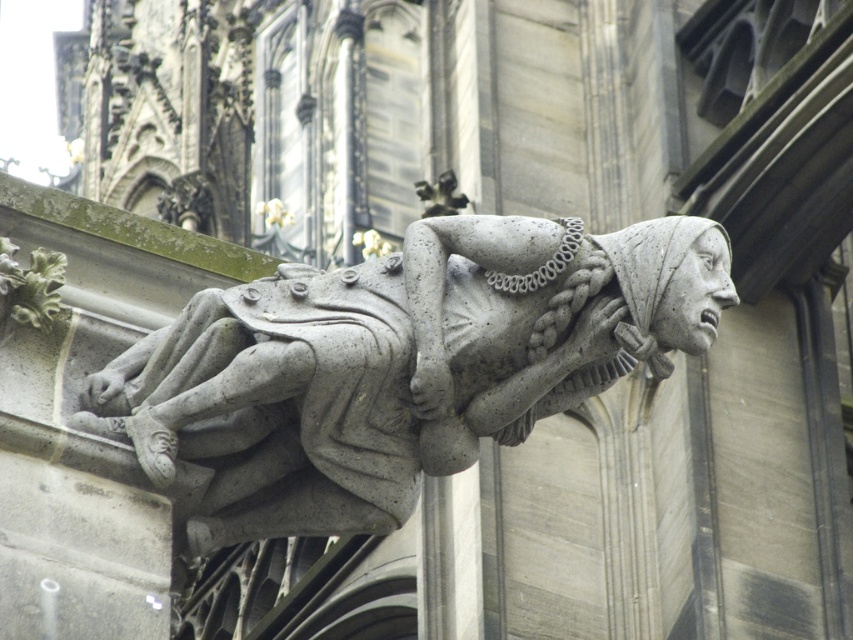
Question: Is gray stone head at center further to camera compared to gray stone gargoyle at upper center?

Choices:
 (A) yes
 (B) no

Answer: (B)

Question: Is gray stone gargoyle at center positioned behind gray stone head at center?

Choices:
 (A) yes
 (B) no

Answer: (A)

Question: Among these objects, which one is farthest from the camera?

Choices:
 (A) gray stone head at center
 (B) gray stone gargoyle at center
 (C) gray stone gargoyle at upper center

Answer: (C)

Question: Which object appears farthest from the camera in this image?

Choices:
 (A) gray stone gargoyle at center
 (B) gray stone head at center
 (C) gray stone gargoyle at upper center

Answer: (C)

Question: Does gray stone gargoyle at center have a greater width compared to gray stone head at center?

Choices:
 (A) yes
 (B) no

Answer: (A)

Question: Estimate the real-world distances between objects in this image. Which object is farther from the gray stone gargoyle at center?

Choices:
 (A) gray stone gargoyle at upper center
 (B) gray stone head at center

Answer: (A)